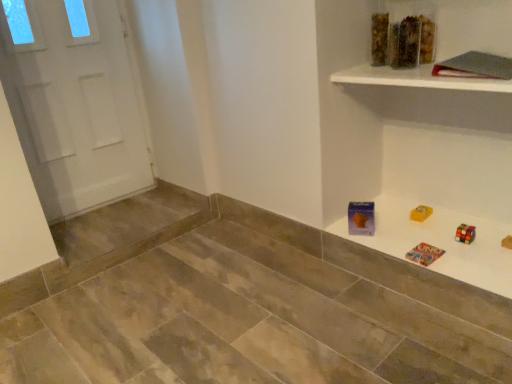
Question: From a real-world perspective, is translucent plastic container at upper right, the 2th toy when ordered from left to right, located beneath white glossy shelf at upper right?

Choices:
 (A) no
 (B) yes

Answer: (A)

Question: Can we say translucent plastic container at upper right, which is the first toy in right-to-left order, lies outside white glossy shelf at upper right?

Choices:
 (A) yes
 (B) no

Answer: (A)

Question: Is translucent plastic container at upper right, the 2th toy when ordered from left to right, shorter than white glossy shelf at upper right?

Choices:
 (A) yes
 (B) no

Answer: (B)

Question: From a real-world perspective, is translucent plastic container at upper right, which is the first toy in right-to-left order, located higher than white glossy shelf at upper right?

Choices:
 (A) yes
 (B) no

Answer: (A)

Question: Is white glossy shelf at upper right surrounded by translucent plastic container at upper right, the 2th toy when ordered from left to right?

Choices:
 (A) no
 (B) yes

Answer: (A)

Question: From their relative heights in the image, would you say translucent plastic container at upper right, the 2th toy when ordered from left to right, is taller or shorter than translucent plastic container at upper center?

Choices:
 (A) tall
 (B) short

Answer: (B)

Question: Is translucent plastic container at upper right, which is the first toy in right-to-left order, in front of or behind translucent plastic container at upper center in the image?

Choices:
 (A) front
 (B) behind

Answer: (A)

Question: In the image, is translucent plastic container at upper right, which is the first toy in right-to-left order, on the left side or the right side of translucent plastic container at upper center?

Choices:
 (A) right
 (B) left

Answer: (A)

Question: Based on their sizes in the image, would you say translucent plastic container at upper right, which is the first toy in right-to-left order, is bigger or smaller than translucent plastic container at upper center?

Choices:
 (A) big
 (B) small

Answer: (A)

Question: Relative to multicolored plastic puzzle at upper right, is translucent plastic container at upper right, which is the first toy in right-to-left order, in front or behind?

Choices:
 (A) behind
 (B) front

Answer: (A)

Question: From a real-world perspective, is translucent plastic container at upper right, the 2th toy when ordered from left to right, physically located above or below multicolored plastic puzzle at upper right?

Choices:
 (A) below
 (B) above

Answer: (B)

Question: Is translucent plastic container at upper right, which is the first toy in right-to-left order, spatially inside multicolored plastic puzzle at upper right, or outside of it?

Choices:
 (A) outside
 (B) inside

Answer: (A)

Question: Considering the positions of translucent plastic container at upper right, which is the first toy in right-to-left order, and multicolored plastic puzzle at upper right in the image, is translucent plastic container at upper right, which is the first toy in right-to-left order, wider or thinner than multicolored plastic puzzle at upper right?

Choices:
 (A) thin
 (B) wide

Answer: (A)

Question: Considering their positions, is translucent plastic container at upper right, positioned as the 2th toy in right-to-left order, located in front of or behind translucent plastic container at upper right, which is the first toy in right-to-left order?

Choices:
 (A) front
 (B) behind

Answer: (A)

Question: From a real-world perspective, is translucent plastic container at upper right, positioned as the 2th toy in right-to-left order, physically located above or below translucent plastic container at upper right, which is the first toy in right-to-left order?

Choices:
 (A) below
 (B) above

Answer: (B)